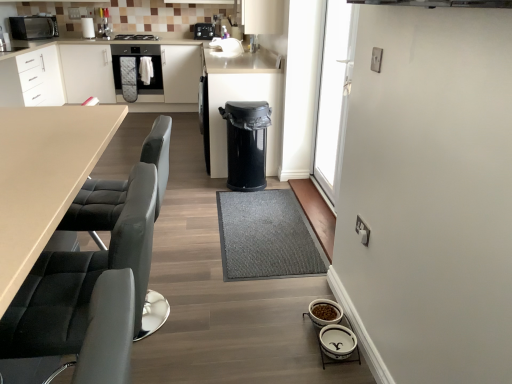
Image resolution: width=512 pixels, height=384 pixels. Identify the location of free spot to the left of black plastic trash can at center. (214, 183).